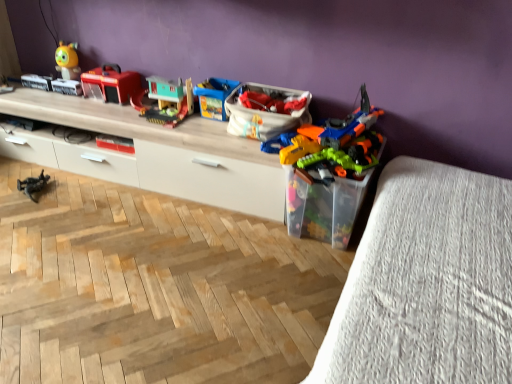
Find the location of a particular element. vacant space to the left of metallic gray toy soldier at lower left, marked as the 1th toy in a left-to-right arrangement is located at coordinates (11, 185).